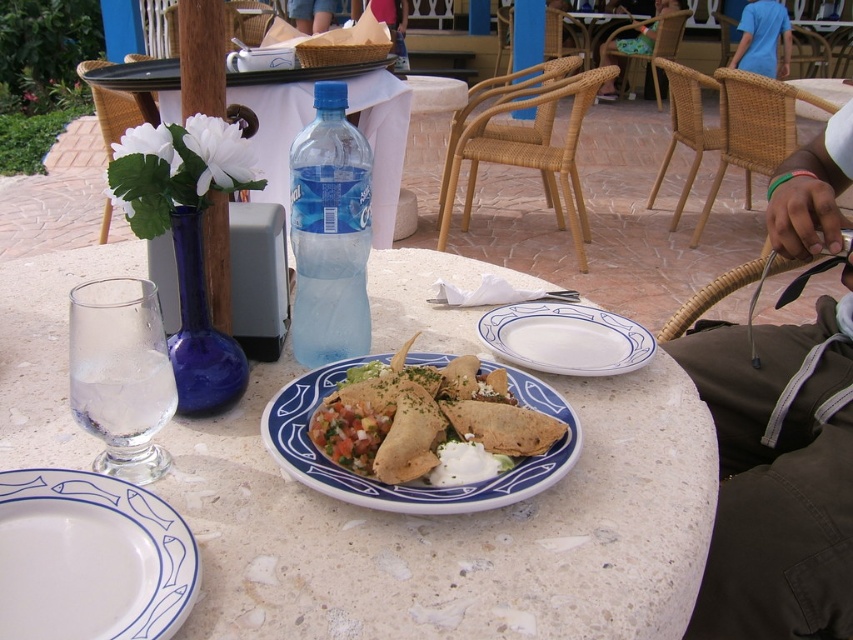
Question: Does white ceramic plate at lower left appear over translucent plastic bottle at center?

Choices:
 (A) no
 (B) yes

Answer: (A)

Question: Among these objects, which one is farthest from the camera?

Choices:
 (A) white ceramic plate at center
 (B) white ceramic plate at lower left

Answer: (A)

Question: Does white ceramic plate at center appear over blue cotton shirt at upper right?

Choices:
 (A) no
 (B) yes

Answer: (A)

Question: Can you confirm if white marble plate at center is positioned to the left of white ceramic plate at center?

Choices:
 (A) yes
 (B) no

Answer: (A)

Question: Which object is closer to the camera taking this photo?

Choices:
 (A) brown fabric pants at lower right
 (B) blue ceramic plate at center
 (C) white marble plate at center
 (D) white ceramic plate at center

Answer: (C)

Question: Which object is farther from the camera taking this photo?

Choices:
 (A) blue ceramic plate at center
 (B) translucent plastic bottle at center
 (C) brown fabric pants at lower right
 (D) white ceramic plate at lower left

Answer: (C)